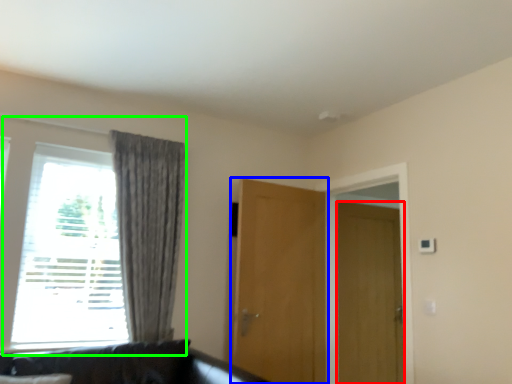
Question: Which object is the farthest from door (highlighted by a red box)? Choose among these: door (highlighted by a blue box) or window (highlighted by a green box).

Choices:
 (A) door
 (B) window

Answer: (B)